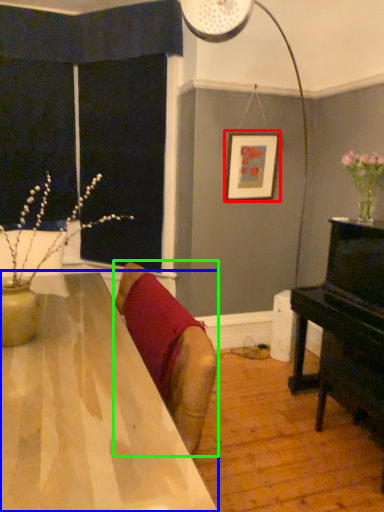
Question: Based on their relative distances, which object is farther from picture frame (highlighted by a red box)? Choose from table (highlighted by a blue box) and swivel chair (highlighted by a green box).

Choices:
 (A) table
 (B) swivel chair

Answer: (A)